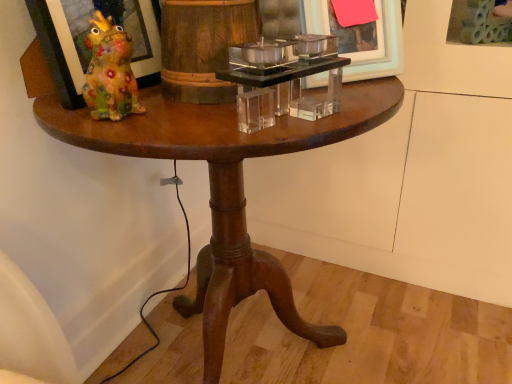
You are a GUI agent. You are given a task and a screenshot of the screen. Output one action in this format:
    pyautogui.click(x=<x>, y=<y>)
    Task: Click on the free space to the left of clear acrylic candle holder at center
    The height and width of the screenshot is (384, 512).
    Given the screenshot: What is the action you would take?
    pyautogui.click(x=147, y=123)